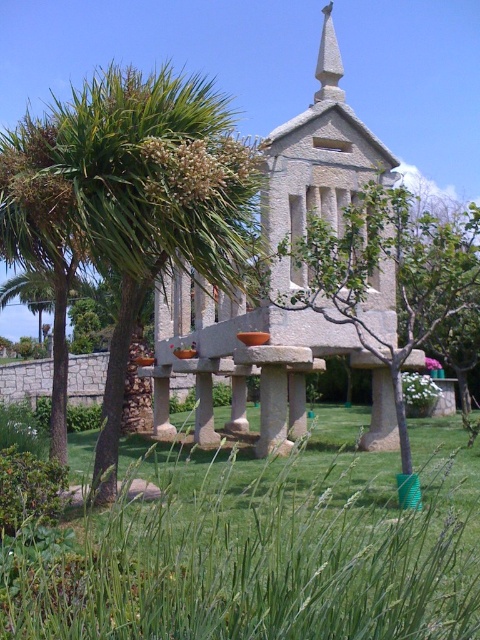
Who is more forward, (274, 145) or (333, 52)?

Point (274, 145)

Which is in front, point (287, 330) or point (325, 6)?

Point (287, 330) is in front.

I want to click on stone chapel at center, so pyautogui.click(x=319, y=166).

Is green grass at center thinner than stone chapel at center?

In fact, green grass at center might be wider than stone chapel at center.

Which of these two, green grass at center or stone chapel at center, stands shorter?

green grass at center is shorter.

Where is `green grass at center`? green grass at center is located at coordinates (263, 547).

Does green grass at center have a lesser height compared to green leafy palm tree at center?

Yes.

Is green grass at center to the right of green leafy palm tree at center from the viewer's perspective?

Correct, you'll find green grass at center to the right of green leafy palm tree at center.

I want to click on green grass at center, so click(263, 547).